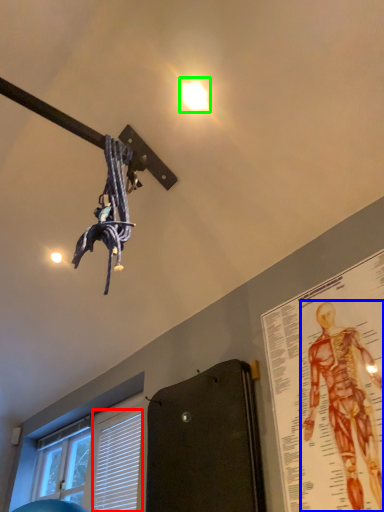
Question: Which object is positioned closest to blind (highlighted by a red box)? Select from person (highlighted by a blue box) and droplight (highlighted by a green box).

Choices:
 (A) person
 (B) droplight

Answer: (A)